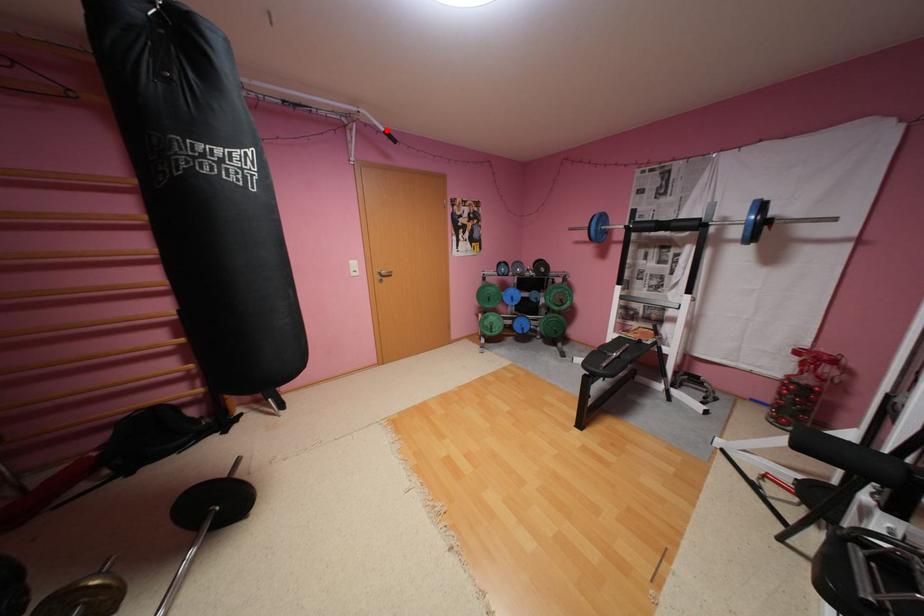
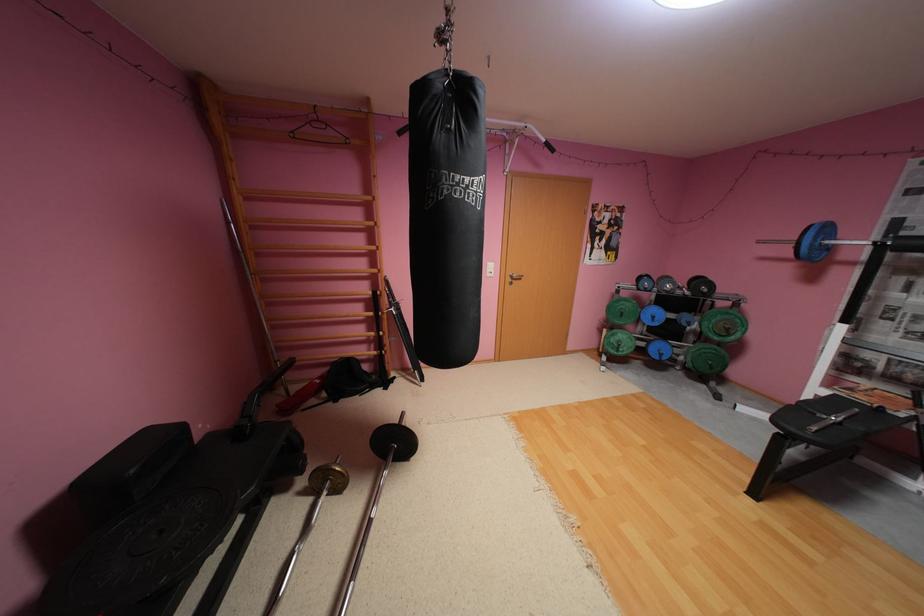
Locate, in the second image, the point that corresponds to the highlighted location in the first image.

(544, 140)